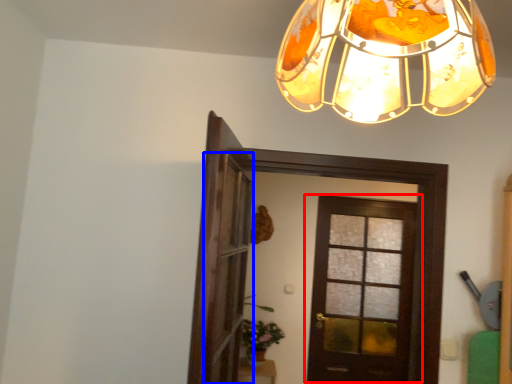
Question: Which point is further to the camera, door (highlighted by a red box) or screen door (highlighted by a blue box)?

Choices:
 (A) door
 (B) screen door

Answer: (A)